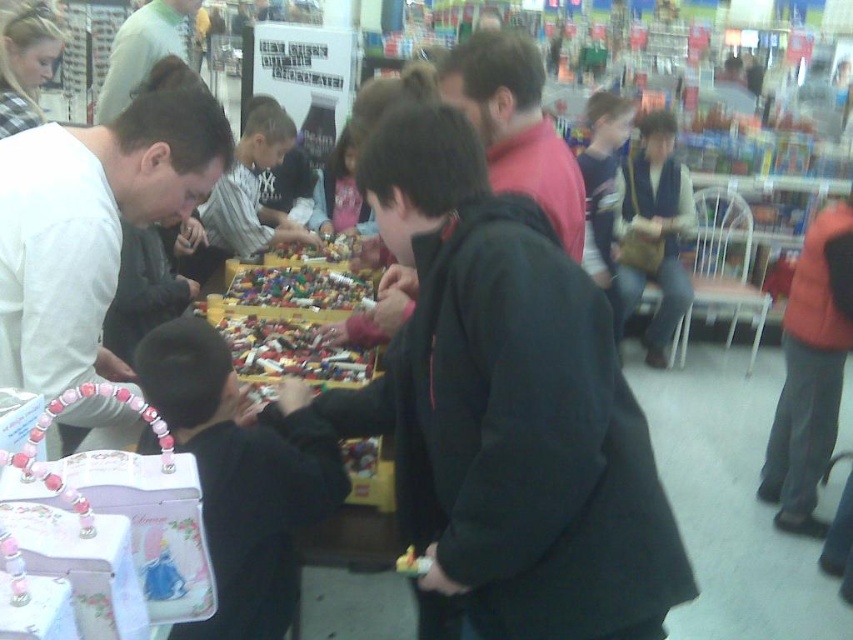
Can you confirm if red matte shirt at center is positioned above multicolored plastic lego bricks at center?

Yes, red matte shirt at center is above multicolored plastic lego bricks at center.

Does red matte shirt at center have a larger size compared to multicolored plastic lego bricks at center?

No, red matte shirt at center is not bigger than multicolored plastic lego bricks at center.

Who is more forward, (x=491, y=84) or (x=344, y=522)?

Point (x=344, y=522)

The height and width of the screenshot is (640, 853). I want to click on red matte shirt at center, so click(x=515, y=125).

Does dark brown hair at center have a larger size compared to matte pink shirt at center?

Correct, dark brown hair at center is larger in size than matte pink shirt at center.

Is dark brown hair at center in front of matte pink shirt at center?

Yes, it is in front of matte pink shirt at center.

Where is `dark brown hair at center`? dark brown hair at center is located at coordinates (251, 188).

You are a GUI agent. You are given a task and a screenshot of the screen. Output one action in this format:
    pyautogui.click(x=<x>, y=<y>)
    Task: Click on the dark brown hair at center
    Image resolution: width=853 pixels, height=640 pixels.
    Given the screenshot: What is the action you would take?
    pyautogui.click(x=251, y=188)

Is multicolored plastic lego bricks at center above light green shirt at upper left?

No, multicolored plastic lego bricks at center is not above light green shirt at upper left.

Describe the element at coordinates (358, 520) in the screenshot. I see `multicolored plastic lego bricks at center` at that location.

Does point (370, 365) lie in front of point (97, 115)?

Yes, it is.

Where is `multicolored plastic lego bricks at center`? multicolored plastic lego bricks at center is located at coordinates (358, 520).